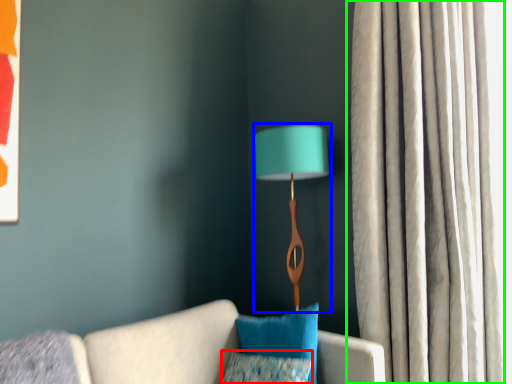
Question: Which is farther away from pillow (highlighted by a red box)? lamp (highlighted by a blue box) or curtain (highlighted by a green box)?

Choices:
 (A) lamp
 (B) curtain

Answer: (B)